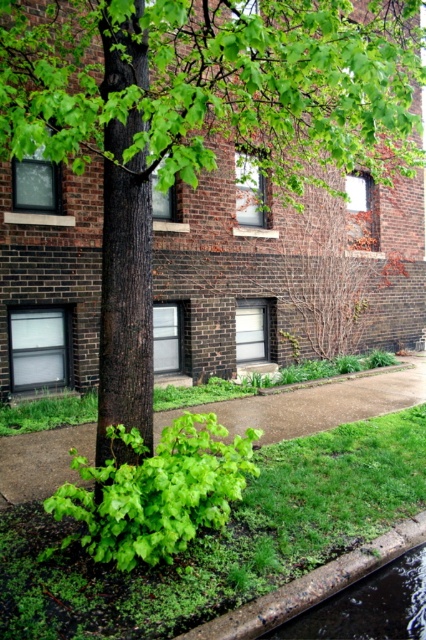
Question: Is green leafy grass at lower center closer to camera compared to green grass at lower center?

Choices:
 (A) yes
 (B) no

Answer: (A)

Question: Is green leafy grass at lower center thinner than green grass at lower center?

Choices:
 (A) no
 (B) yes

Answer: (A)

Question: Which object is closer to the camera taking this photo?

Choices:
 (A) green leafy grass at lower center
 (B) green grass at lower center

Answer: (A)

Question: From the image, what is the correct spatial relationship of green leafy grass at lower center in relation to green grass at lower center?

Choices:
 (A) right
 (B) left

Answer: (B)